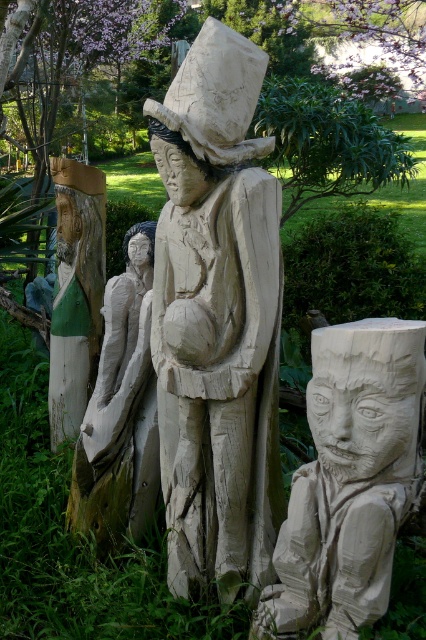
Consider the image. You are an art conservator assessing the placement of two wooden sculptures in a garden. The statues are labeled as the natural wood statue at center and the natural wood carving at center. Based on their sizes, which one would require a more stable base to prevent tipping over?

The natural wood statue at center is taller than the natural wood carving at center, so it would require a more stable base to prevent tipping over due to its greater height increasing the risk of instability.

You are an artist planning to display the carved wood face at lower right and the natural wood carving at center in a gallery. Which sculpture has a greater width?

The carved wood face at lower right has a greater width than the natural wood carving at center.